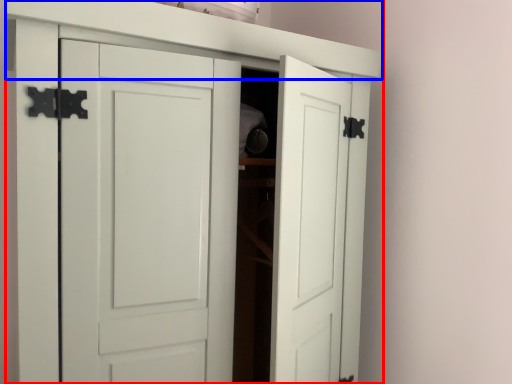
Question: Among these objects, which one is nearest to the camera, cupboard (highlighted by a red box) or shelf (highlighted by a blue box)?

Choices:
 (A) cupboard
 (B) shelf

Answer: (A)